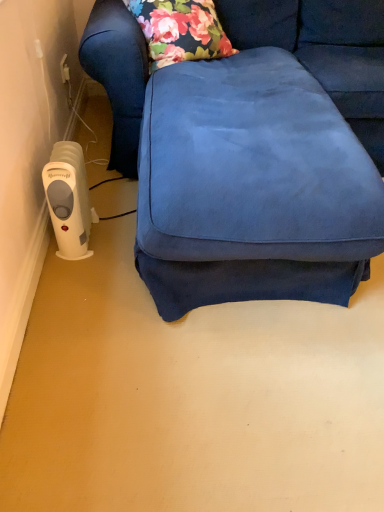
Where is `white plastic heater at lower left`? The image size is (384, 512). white plastic heater at lower left is located at coordinates (69, 200).

What do you see at coordinates (69, 200) in the screenshot? I see `white plastic heater at lower left` at bounding box center [69, 200].

At what (x,y) coordinates should I click in order to perform the action: click on suede blue couch at center. Please return your answer as a coordinate pair (x, y). Looking at the image, I should click on (238, 161).

Describe the element at coordinates (238, 161) in the screenshot. I see `suede blue couch at center` at that location.

At what (x,y) coordinates should I click in order to perform the action: click on white plastic heater at lower left. Please return your answer as a coordinate pair (x, y). Image resolution: width=384 pixels, height=512 pixels. Looking at the image, I should click on (69, 200).

Considering the positions of objects suede blue couch at center and white plastic heater at lower left in the image provided, who is more to the left, suede blue couch at center or white plastic heater at lower left?

From the viewer's perspective, white plastic heater at lower left appears more on the left side.

Considering the positions of objects suede blue couch at center and white plastic heater at lower left in the image provided, who is behind, suede blue couch at center or white plastic heater at lower left?

Positioned behind is white plastic heater at lower left.

Considering the positions of points (243, 20) and (73, 152), is point (243, 20) farther from camera compared to point (73, 152)?

Yes, it is.

From the image's perspective, would you say suede blue couch at center is positioned over white plastic heater at lower left?

Yes, from the image's perspective, suede blue couch at center is over white plastic heater at lower left.

From a real-world perspective, which object rests below the other?

white plastic heater at lower left, from a real-world perspective.

Which of these two, suede blue couch at center or white plastic heater at lower left, is thinner?

white plastic heater at lower left.

Considering the sizes of suede blue couch at center and white plastic heater at lower left in the image, is suede blue couch at center taller or shorter than white plastic heater at lower left?

suede blue couch at center is taller than white plastic heater at lower left.

Can you confirm if suede blue couch at center is smaller than white plastic heater at lower left?

No, suede blue couch at center is not smaller than white plastic heater at lower left.

Is suede blue couch at center not within white plastic heater at lower left?

suede blue couch at center is positioned outside white plastic heater at lower left.

Is there a large distance between suede blue couch at center and white plastic heater at lower left?

suede blue couch at center is actually quite close to white plastic heater at lower left.

Based on the photo, is suede blue couch at center looking in the opposite direction of white plastic heater at lower left?

No, white plastic heater at lower left is not at the back of suede blue couch at center.

How different are the orientations of suede blue couch at center and white plastic heater at lower left in degrees?

The facing directions of suede blue couch at center and white plastic heater at lower left are 3.24 degrees apart.

Where is `appliance below the suede blue couch at center (from a real-world perspective)`? The height and width of the screenshot is (512, 384). appliance below the suede blue couch at center (from a real-world perspective) is located at coordinates (69, 200).

Is white plastic heater at lower left to the left of suede blue couch at center from the viewer's perspective?

Correct, you'll find white plastic heater at lower left to the left of suede blue couch at center.

Is white plastic heater at lower left closer to camera compared to suede blue couch at center?

No, white plastic heater at lower left is further to the viewer.

Is point (66, 205) positioned after point (259, 35)?

No, it is not.

From the image's perspective, is white plastic heater at lower left beneath suede blue couch at center?

Correct, white plastic heater at lower left appears lower than suede blue couch at center in the image.

From a real-world perspective, is white plastic heater at lower left over suede blue couch at center?

No.

Consider the image. Considering the sizes of objects white plastic heater at lower left and suede blue couch at center in the image provided, who is thinner, white plastic heater at lower left or suede blue couch at center?

white plastic heater at lower left.

Does white plastic heater at lower left have a greater height compared to suede blue couch at center?

No.

Is white plastic heater at lower left bigger than suede blue couch at center?

Incorrect, white plastic heater at lower left is not larger than suede blue couch at center.

Is white plastic heater at lower left inside or outside of suede blue couch at center?

The correct answer is: inside.

Is white plastic heater at lower left touching suede blue couch at center?

No, white plastic heater at lower left is not in contact with suede blue couch at center.

Is white plastic heater at lower left oriented towards suede blue couch at center?

Yes, white plastic heater at lower left faces towards suede blue couch at center.

How different are the orientations of white plastic heater at lower left and suede blue couch at center in degrees?

The angle between the facing direction of white plastic heater at lower left and the facing direction of suede blue couch at center is 3.24 degrees.

You are a GUI agent. You are given a task and a screenshot of the screen. Output one action in this format:
    pyautogui.click(x=<x>, y=<y>)
    Task: Click on the appliance to the left of suede blue couch at center
    
    Given the screenshot: What is the action you would take?
    pyautogui.click(x=69, y=200)

This screenshot has width=384, height=512. In order to click on studio couch on the right of white plastic heater at lower left in this screenshot , I will do `click(238, 161)`.

Locate an element on the screen. appliance behind the suede blue couch at center is located at coordinates (69, 200).